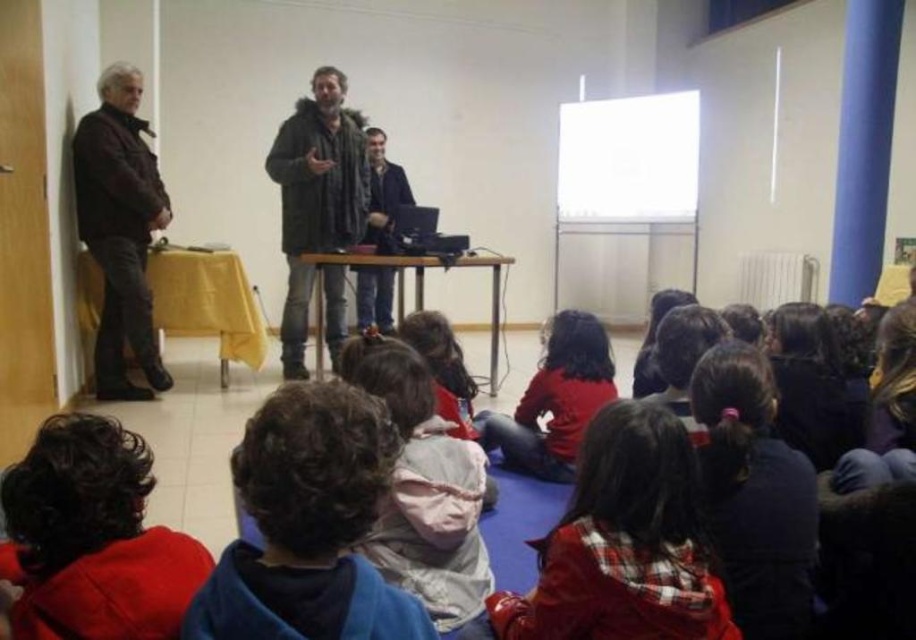
Is the position of dark blue fleece at center more distant than that of white cotton jacket at center?

That is False.

Which is in front, point (290, 401) or point (435, 544)?

Point (290, 401) is more forward.

Image resolution: width=916 pixels, height=640 pixels. I want to click on dark blue fleece at center, so click(308, 525).

Is red fleece jacket at lower left to the right of dark brown leather jacket at left from the viewer's perspective?

Correct, you'll find red fleece jacket at lower left to the right of dark brown leather jacket at left.

Does red fleece jacket at lower left have a lesser height compared to dark brown leather jacket at left?

Yes.

Measure the distance between red fleece jacket at lower left and camera.

A distance of 1.14 meters exists between red fleece jacket at lower left and camera.

Image resolution: width=916 pixels, height=640 pixels. What are the coordinates of `red fleece jacket at lower left` in the screenshot? It's located at (94, 538).

Is red fleece jacket at lower left in front of dark blue fabric jacket at center?

Yes, red fleece jacket at lower left is closer to the viewer.

Based on the photo, can you confirm if red fleece jacket at lower left is positioned to the left of dark blue fabric jacket at center?

Correct, you'll find red fleece jacket at lower left to the left of dark blue fabric jacket at center.

Image resolution: width=916 pixels, height=640 pixels. I want to click on red fleece jacket at lower left, so click(x=94, y=538).